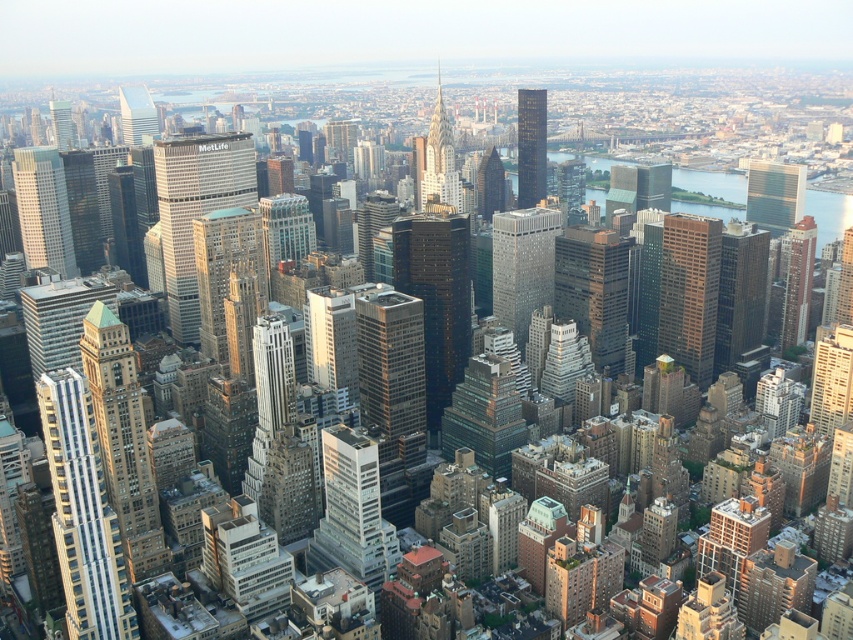
You are a drone operator flying over the city. You notice two skyscrapers labeled as the matte glass skyscraper at center and the dark glass skyscraper at center. Which one is positioned higher in the aerial view?

The matte glass skyscraper at center is located above the dark glass skyscraper at center, so it is positioned higher in the aerial view.

You are a drone operator tasked with capturing aerial footage of the city. Your drone has a maximum flight range of 2000 feet. If you are currently positioned at the viewer location, can your drone reach the sleek glass skyscraper at center without exceeding its range?

The distance between the sleek glass skyscraper at center and the viewer is 1967.75 feet, which is within the drone operator drone maximum flight range of 2000 feet. Therefore, the drone can reach the sleek glass skyscraper at center without exceeding its range.